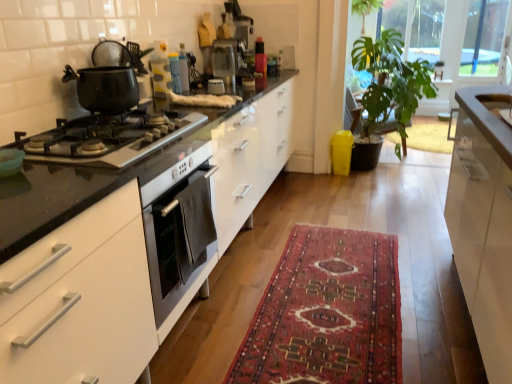
Question: Considering the positions of point (87, 160) and point (309, 307), is point (87, 160) closer or farther from the camera than point (309, 307)?

Choices:
 (A) closer
 (B) farther

Answer: (A)

Question: Would you say shiny black gas stove at left, the 1th gas stove positioned from the top, is to the left or to the right of red woven rug at center in the picture?

Choices:
 (A) right
 (B) left

Answer: (B)

Question: Which object is positioned farthest from the red woven rug at center?

Choices:
 (A) transparent plastic coffee machine at center
 (B) transparent glass window screen at upper right, positioned as the 1th window screen in right-to-left order
 (C) black glass gas stove at left, the 2th gas stove when ordered from top to bottom
 (D) white glossy cabinet at right
 (E) granite black pot at left

Answer: (B)

Question: Which object is positioned farthest from the white glossy cabinet at right?

Choices:
 (A) metallic silver toaster at center, the first appliance in the right-to-left sequence
 (B) transparent glass window screen at upper right, the second window screen in the left-to-right sequence
 (C) white glossy sink at upper right
 (D) shiny black gas stove at left, the 1th gas stove positioned from the top
 (E) black glass gas stove at left, the first gas stove when ordered from bottom to top

Answer: (B)